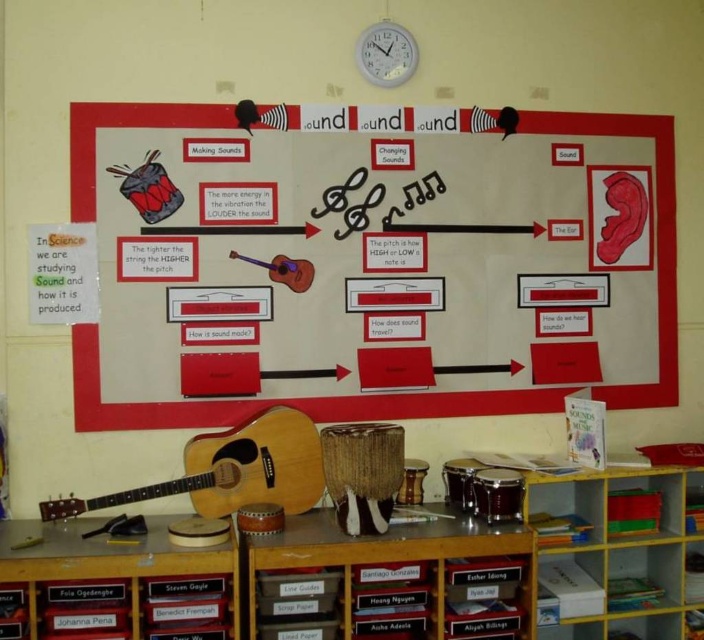
Question: Which object is farther from the camera taking this photo?

Choices:
 (A) matte brown guitar at center
 (B) natural wood acoustic guitar at lower left
 (C) matte white paper at center

Answer: (A)

Question: Is the position of matte white paper at center more distant than that of natural wood acoustic guitar at lower left?

Choices:
 (A) yes
 (B) no

Answer: (A)

Question: Which object appears farthest from the camera in this image?

Choices:
 (A) natural wood acoustic guitar at lower left
 (B) matte brown guitar at center
 (C) matte white paper at center

Answer: (B)

Question: Is matte white paper at center above natural wood acoustic guitar at lower left?

Choices:
 (A) no
 (B) yes

Answer: (B)

Question: Is natural wood acoustic guitar at lower left above gray plastic clock at upper center?

Choices:
 (A) yes
 (B) no

Answer: (B)

Question: Estimate the real-world distances between objects in this image. Which object is closer to the natural wood acoustic guitar at lower left?

Choices:
 (A) matte brown guitar at center
 (B) gray plastic clock at upper center

Answer: (A)